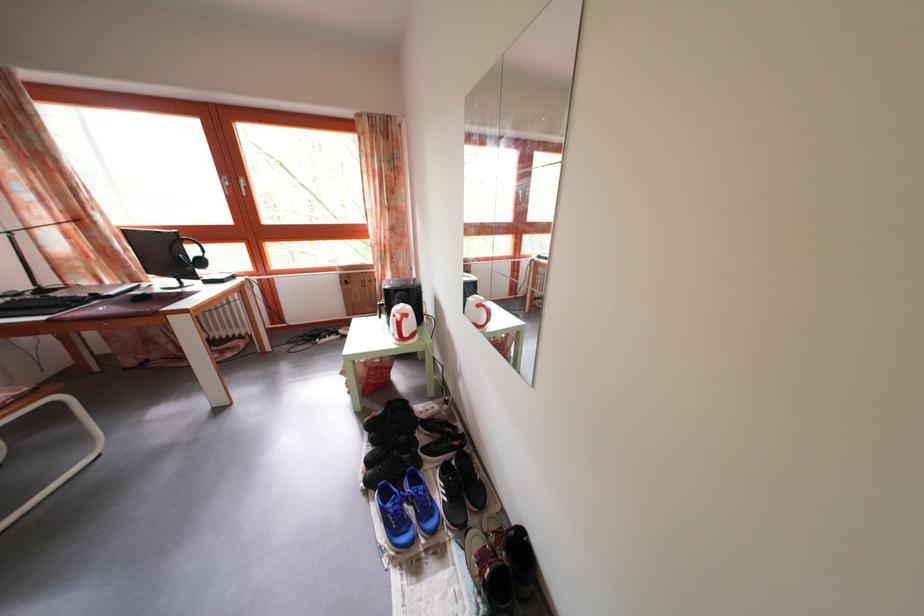
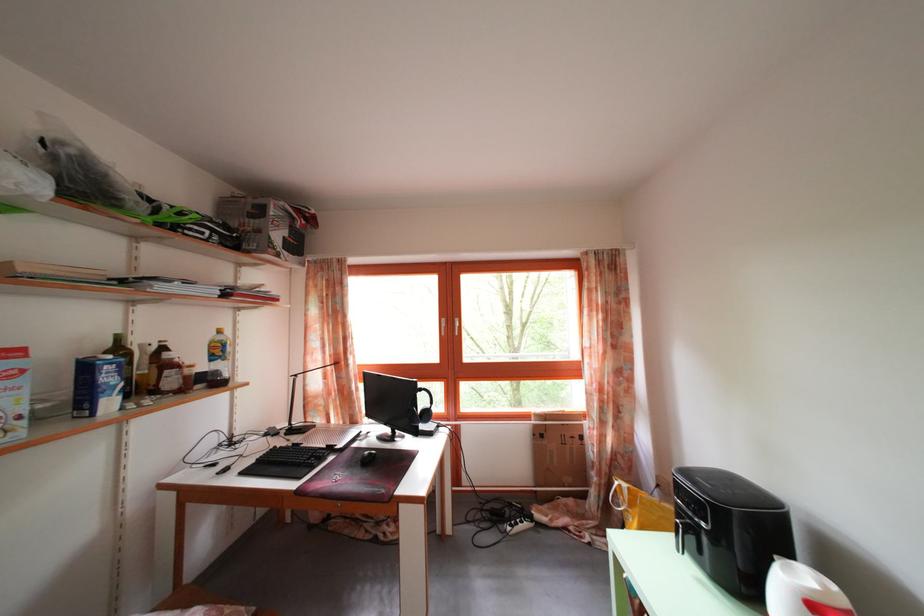
The point at (348, 283) is marked in the first image. Where is the corresponding point in the second image?

(542, 432)